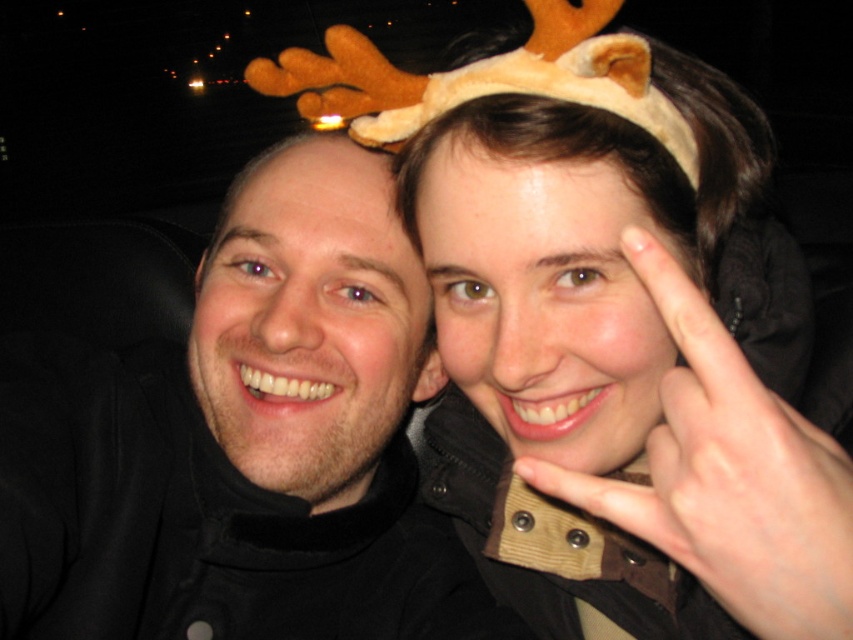
Question: From the image, what is the correct spatial relationship of fuzzy brown headband at upper center in relation to matte black hair at left?

Choices:
 (A) below
 (B) above

Answer: (A)

Question: Which object is farther from the camera taking this photo?

Choices:
 (A) matte black jacket at center
 (B) fuzzy brown headband at upper center

Answer: (A)

Question: Which point is closer to the camera?

Choices:
 (A) matte black jacket at center
 (B) fuzzy brown headband at upper center
 (C) matte black hair at left

Answer: (B)

Question: Estimate the real-world distances between objects in this image. Which object is closer to the fuzzy brown headband at upper center?

Choices:
 (A) matte black jacket at center
 (B) matte black hair at left

Answer: (B)

Question: Is fuzzy brown headband at upper center to the left of matte black jacket at center from the viewer's perspective?

Choices:
 (A) no
 (B) yes

Answer: (A)

Question: Is fuzzy brown headband at upper center in front of matte black hair at left?

Choices:
 (A) yes
 (B) no

Answer: (A)